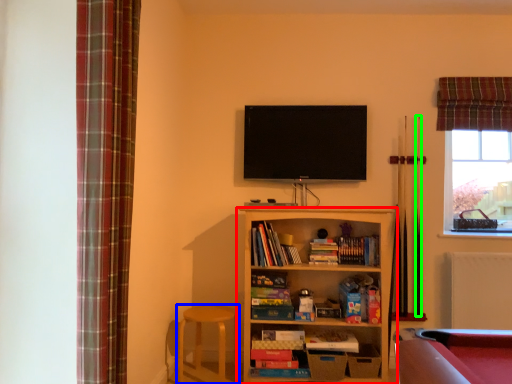
Question: Which object is the farthest from shelf (highlighted by a red box)? Choose among these: bar stool (highlighted by a blue box) or cue (highlighted by a green box).

Choices:
 (A) bar stool
 (B) cue

Answer: (B)